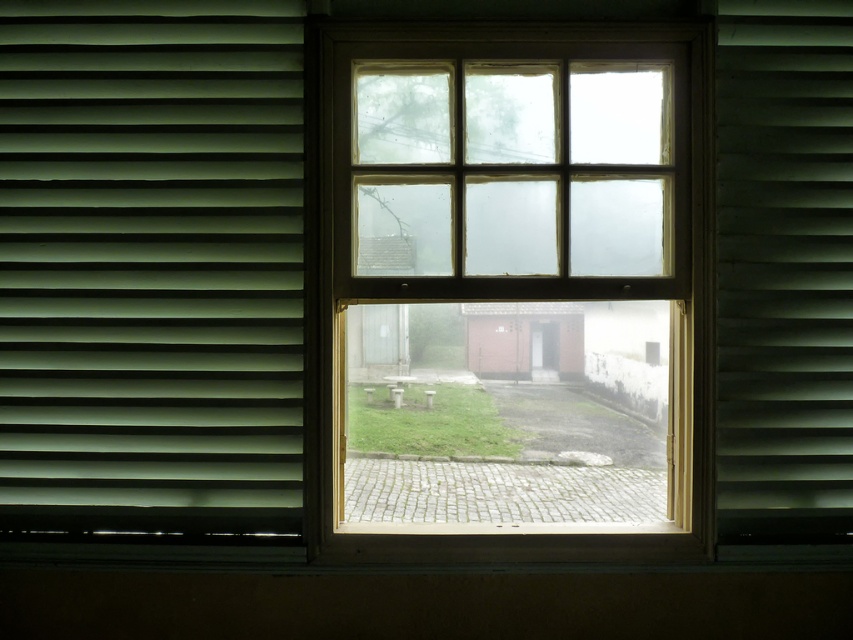
Question: From the image, what is the correct spatial relationship of green matte blinds at left in relation to green matte shutter at right?

Choices:
 (A) above
 (B) below

Answer: (B)

Question: Which is farther from the green matte shutter at right?

Choices:
 (A) green matte blinds at left
 (B) clear glass window at center

Answer: (A)

Question: Can you confirm if green matte blinds at left is bigger than green matte shutter at right?

Choices:
 (A) yes
 (B) no

Answer: (A)

Question: Which point is closer to the camera taking this photo?

Choices:
 (A) (372, 260)
 (B) (735, 416)
 (C) (236, 177)

Answer: (C)

Question: Does clear glass window at center appear on the right side of green matte blinds at left?

Choices:
 (A) no
 (B) yes

Answer: (B)

Question: Considering the real-world distances, which object is farthest from the green matte blinds at left?

Choices:
 (A) clear glass window at center
 (B) green matte shutter at right

Answer: (B)